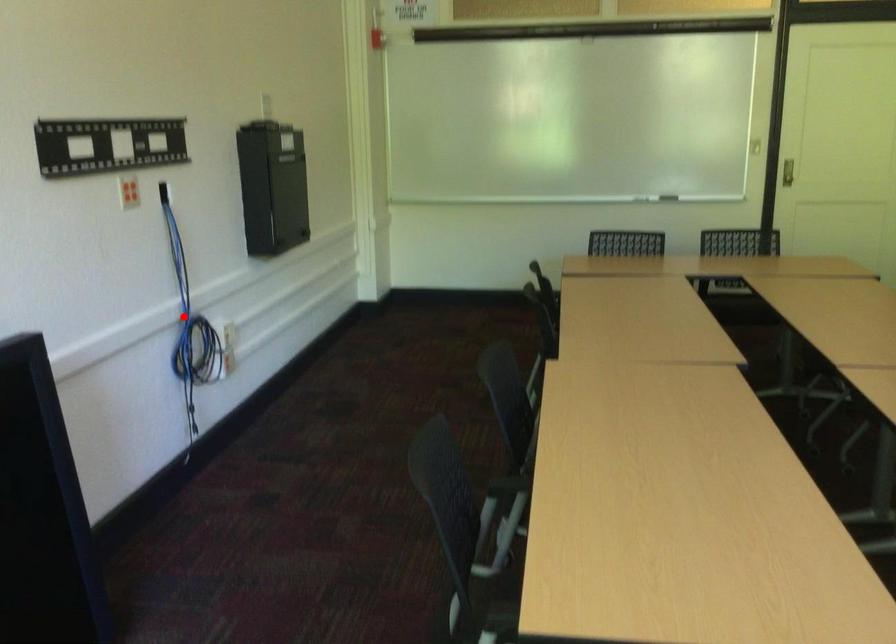
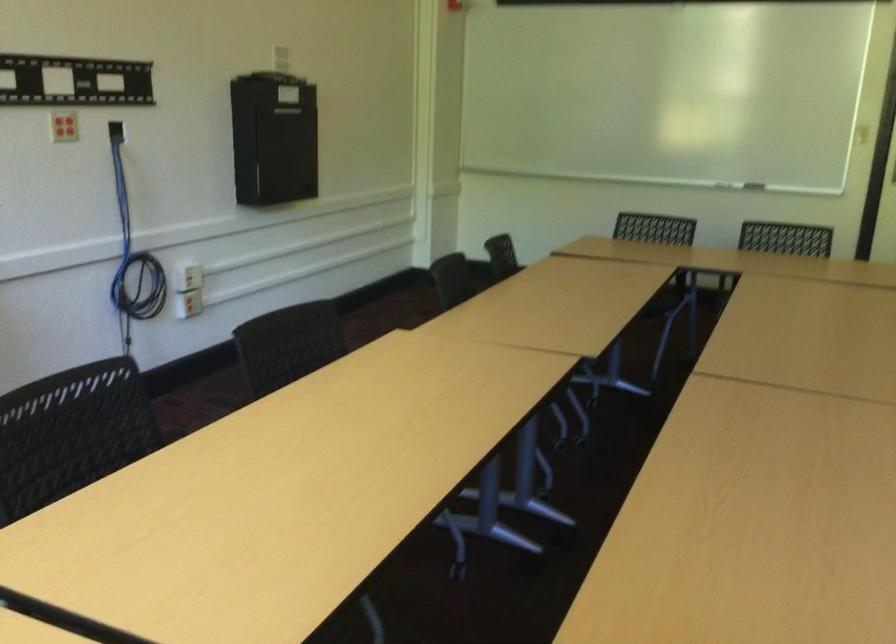
In the second image, find the point that corresponds to the highlighted location in the first image.

(133, 252)